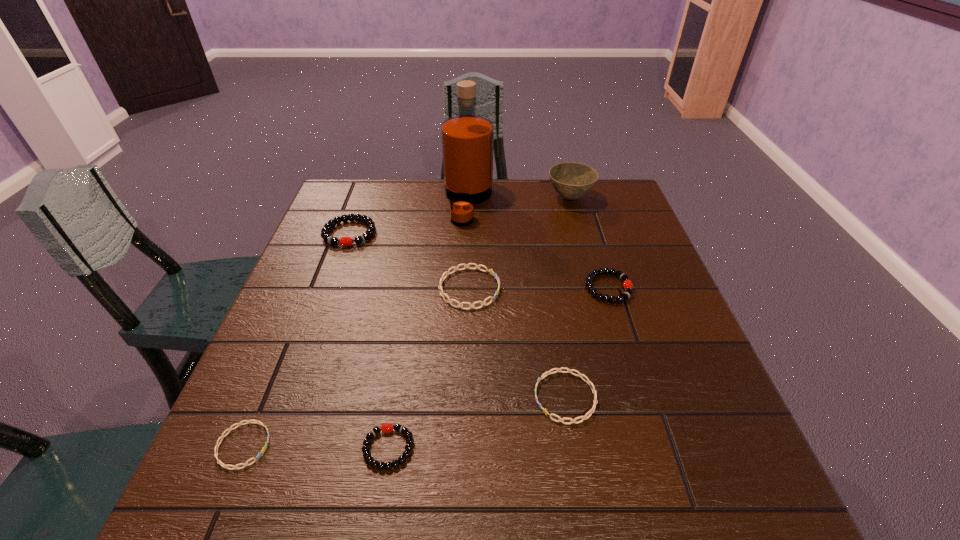
Where is `black bracelet that can be found as the second closest to the smallest blue bracelet`? black bracelet that can be found as the second closest to the smallest blue bracelet is located at coordinates (325, 231).

Where is `black bracelet that is the third closest to the bowl`? black bracelet that is the third closest to the bowl is located at coordinates (386, 428).

Where is `blue bracelet that is the nearest to the leftmost blue bracelet`? blue bracelet that is the nearest to the leftmost blue bracelet is located at coordinates (447, 273).

Where is `blue bracelet that stands as the closest to the rightmost black bracelet`? Image resolution: width=960 pixels, height=540 pixels. blue bracelet that stands as the closest to the rightmost black bracelet is located at coordinates (588, 381).

You are a GUI agent. You are given a task and a screenshot of the screen. Output one action in this format:
    pyautogui.click(x=<x>, y=<y>)
    Task: Click on the free space that satisfies the following two spatial constraints: 1. on the front label of the tallest object; 2. on the front side of the leftmost black bracelet
    The image size is (960, 540).
    Given the screenshot: What is the action you would take?
    pyautogui.click(x=468, y=233)

At what (x,y) coordinates should I click in order to perform the action: click on vacant space that satisfies the following two spatial constraints: 1. on the front label of the liquor; 2. on the front side of the farthest bracelet. Please return your answer as a coordinate pair (x, y). Image resolution: width=960 pixels, height=540 pixels. Looking at the image, I should click on (468, 233).

Locate an element on the screen. The width and height of the screenshot is (960, 540). free region that satisfies the following two spatial constraints: 1. on the front side of the seventh shortest object; 2. on the front label of the liquor is located at coordinates (571, 202).